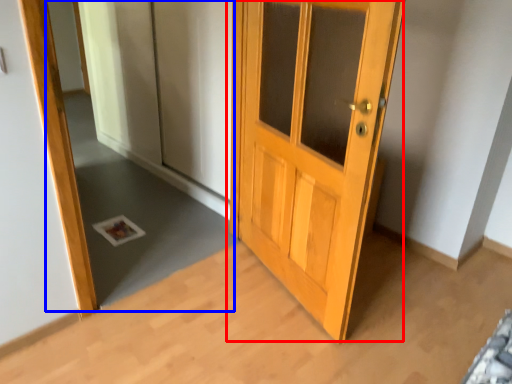
Question: Which object appears farthest to the camera in this image, door (highlighted by a red box) or mirror (highlighted by a blue box)?

Choices:
 (A) door
 (B) mirror

Answer: (B)